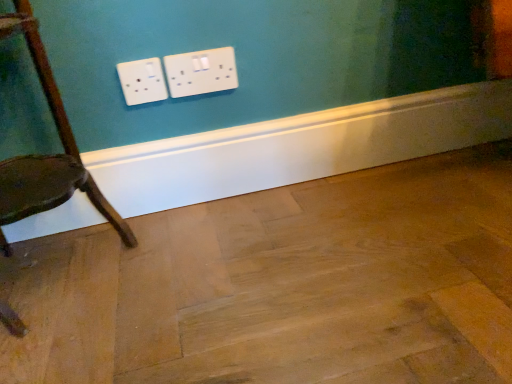
Question: Is wooden chair at left taller or shorter than natural wood floor at center?

Choices:
 (A) tall
 (B) short

Answer: (A)

Question: Considering the positions of wooden chair at left and natural wood floor at center in the image, is wooden chair at left bigger or smaller than natural wood floor at center?

Choices:
 (A) big
 (B) small

Answer: (A)

Question: Does point (15, 168) appear closer or farther from the camera than point (431, 340)?

Choices:
 (A) farther
 (B) closer

Answer: (A)

Question: From a real-world perspective, is natural wood floor at center physically located above or below wooden chair at left?

Choices:
 (A) above
 (B) below

Answer: (B)

Question: Looking at their shapes, would you say natural wood floor at center is wider or thinner than wooden chair at left?

Choices:
 (A) wide
 (B) thin

Answer: (A)

Question: Which is correct: natural wood floor at center is inside wooden chair at left, or outside of it?

Choices:
 (A) inside
 (B) outside

Answer: (B)

Question: From their relative heights in the image, would you say natural wood floor at center is taller or shorter than wooden chair at left?

Choices:
 (A) tall
 (B) short

Answer: (B)